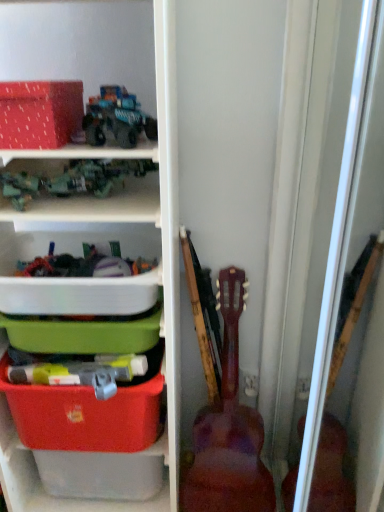
Question: Does white plastic container at center, which is the second storage box in bottom-to-top order, have a greater height compared to teal matte truck at upper center, the second toy in the left-to-right sequence?

Choices:
 (A) no
 (B) yes

Answer: (B)

Question: Is white plastic container at center, the second storage box from the top, aimed at teal matte truck at upper center, which is the first toy from top to bottom?

Choices:
 (A) no
 (B) yes

Answer: (A)

Question: Is white plastic container at center, which is the second storage box in bottom-to-top order, not inside teal matte truck at upper center, the second toy in the left-to-right sequence?

Choices:
 (A) no
 (B) yes

Answer: (B)

Question: Is white plastic container at center, the second storage box from the top, oriented away from teal matte truck at upper center, which is counted as the 1th toy, starting from the right?

Choices:
 (A) no
 (B) yes

Answer: (A)

Question: Can you confirm if white plastic container at center, which is the second storage box in bottom-to-top order, is shorter than teal matte truck at upper center, acting as the 2th toy starting from the bottom?

Choices:
 (A) yes
 (B) no

Answer: (B)

Question: Relative to metallic green toy truck at upper left, which ranks as the second toy in top-to-bottom order, is white plastic container at center, which is the second storage box in bottom-to-top order, in front or behind?

Choices:
 (A) behind
 (B) front

Answer: (A)

Question: Is point (48, 314) positioned closer to the camera than point (117, 159)?

Choices:
 (A) closer
 (B) farther

Answer: (A)

Question: Based on their positions, is white plastic container at center, which is the second storage box in bottom-to-top order, located to the left or right of metallic green toy truck at upper left, which ranks as the 2th toy in right-to-left order?

Choices:
 (A) left
 (B) right

Answer: (B)

Question: From the image's perspective, is white plastic container at center, the second storage box from the top, positioned above or below metallic green toy truck at upper left, which ranks as the 2th toy in right-to-left order?

Choices:
 (A) above
 (B) below

Answer: (B)

Question: Would you say matte plastic storage box at lower left, acting as the 3th storage box starting from the top, is to the left or to the right of metallic green toy truck at upper left, which ranks as the second toy in top-to-bottom order, in the picture?

Choices:
 (A) right
 (B) left

Answer: (A)

Question: In terms of height, does matte plastic storage box at lower left, which is the first storage box in bottom-to-top order, look taller or shorter compared to metallic green toy truck at upper left, which ranks as the second toy in top-to-bottom order?

Choices:
 (A) short
 (B) tall

Answer: (B)

Question: From a real-world perspective, is matte plastic storage box at lower left, acting as the 3th storage box starting from the top, physically located above or below metallic green toy truck at upper left, which ranks as the second toy in top-to-bottom order?

Choices:
 (A) above
 (B) below

Answer: (B)

Question: Looking at the image, does matte plastic storage box at lower left, which is the first storage box in bottom-to-top order, seem bigger or smaller compared to metallic green toy truck at upper left, the first toy when ordered from left to right?

Choices:
 (A) small
 (B) big

Answer: (B)

Question: Considering the positions of wooden acoustic guitar at right and teal matte truck at upper center, which is counted as the 1th toy, starting from the right, in the image, is wooden acoustic guitar at right bigger or smaller than teal matte truck at upper center, which is counted as the 1th toy, starting from the right,?

Choices:
 (A) small
 (B) big

Answer: (B)

Question: Visually, is wooden acoustic guitar at right positioned to the left or to the right of teal matte truck at upper center, acting as the 2th toy starting from the bottom?

Choices:
 (A) right
 (B) left

Answer: (A)